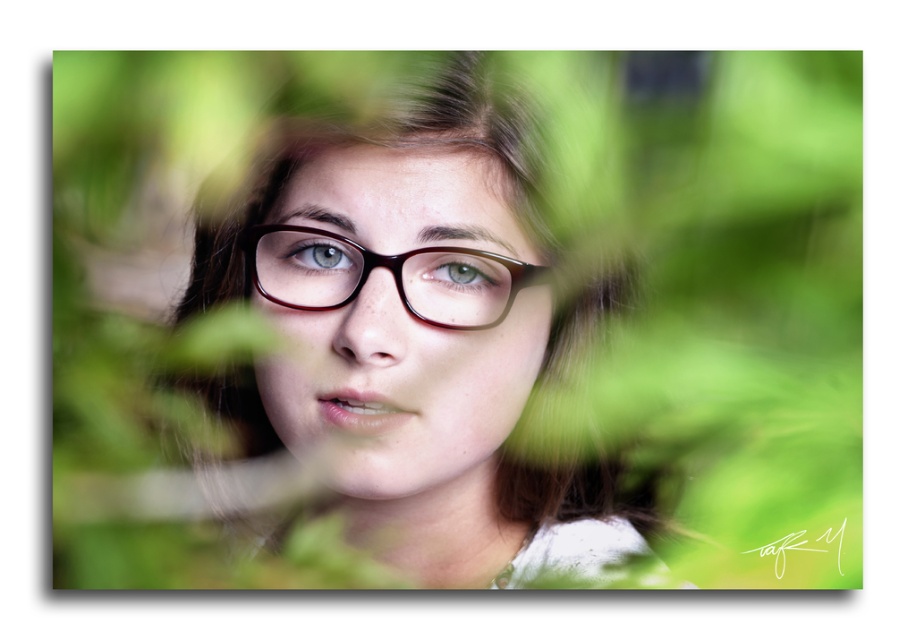
Who is more distant from viewer, (x=287, y=436) or (x=335, y=285)?

Positioned behind is point (x=287, y=436).

Who is more forward, (351, 417) or (281, 284)?

Positioned in front is point (351, 417).

Locate an element on the screen. The height and width of the screenshot is (640, 916). matte brown glasses at center is located at coordinates (416, 340).